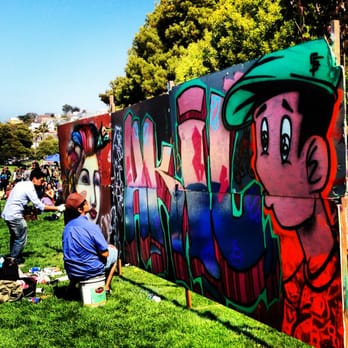
Find the location of `rightmost side of wall`. rightmost side of wall is located at coordinates (333, 225).